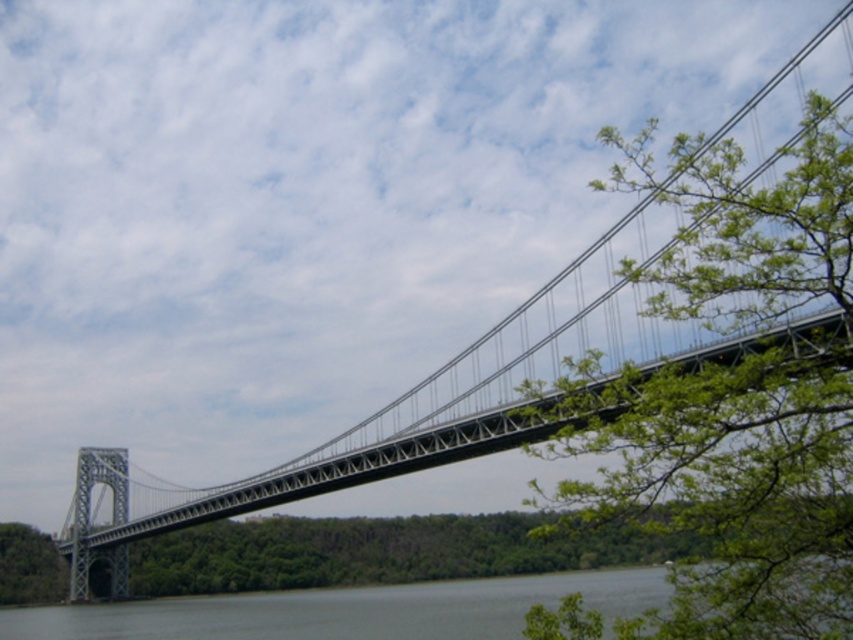
Between point (788, 268) and point (9, 524), which one is positioned behind?

The point (9, 524) is more distant.

Does green leafy tree at upper right have a greater height compared to green leafy tree at lower left?

Yes.

The image size is (853, 640). I want to click on green leafy tree at upper right, so click(735, 394).

Consider the image. Measure the distance between green leafy tree at upper right and greenish water at center.

59.48 meters

Image resolution: width=853 pixels, height=640 pixels. Find the location of `green leafy tree at upper right`. green leafy tree at upper right is located at coordinates (735, 394).

Which is more to the right, greenish water at center or green leafy tree at lower left?

From the viewer's perspective, greenish water at center appears more on the right side.

Does greenish water at center have a greater height compared to green leafy tree at lower left?

Correct, greenish water at center is much taller as green leafy tree at lower left.

Consider the image. Who is more distant from viewer, (456,618) or (4,576)?

Positioned behind is point (4,576).

You are a GUI agent. You are given a task and a screenshot of the screen. Output one action in this format:
    pyautogui.click(x=<x>, y=<y>)
    Task: Click on the greenish water at center
    The height and width of the screenshot is (640, 853).
    Given the screenshot: What is the action you would take?
    (x=349, y=611)